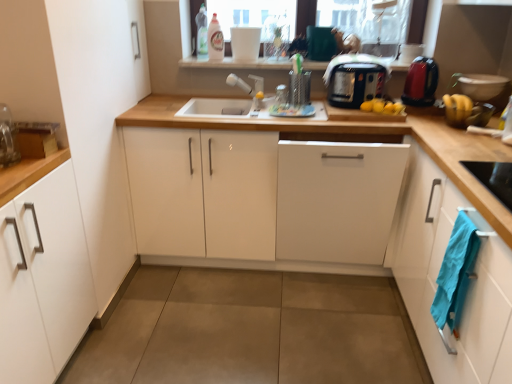
I want to click on blank area to the left of translucent plastic bottle at upper center, placed as the first bottle when sorted from right to left, so click(x=195, y=59).